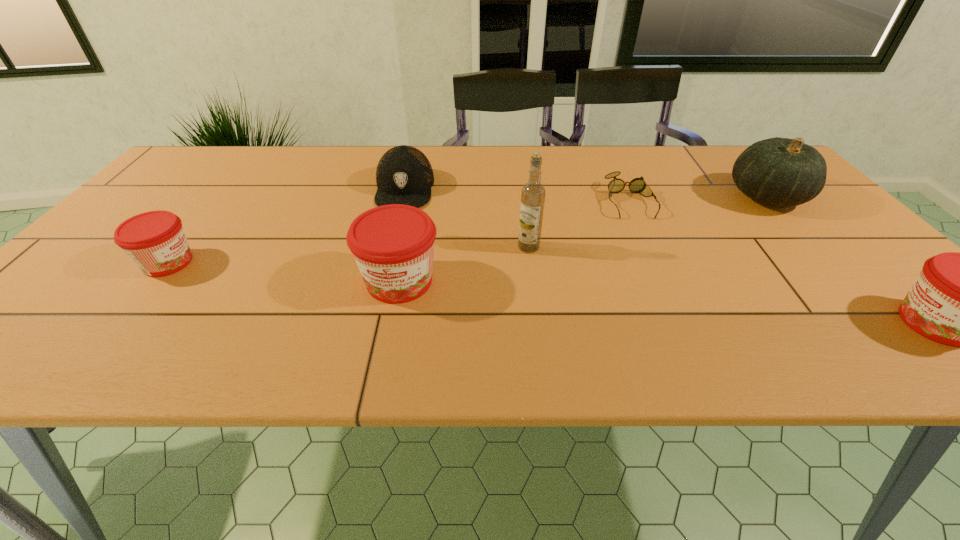
Where is `blank area in the image that satisfies the following two spatial constraints: 1. on the front-facing side of the spectacles; 2. on the label of the vodka`? blank area in the image that satisfies the following two spatial constraints: 1. on the front-facing side of the spectacles; 2. on the label of the vodka is located at coordinates (650, 247).